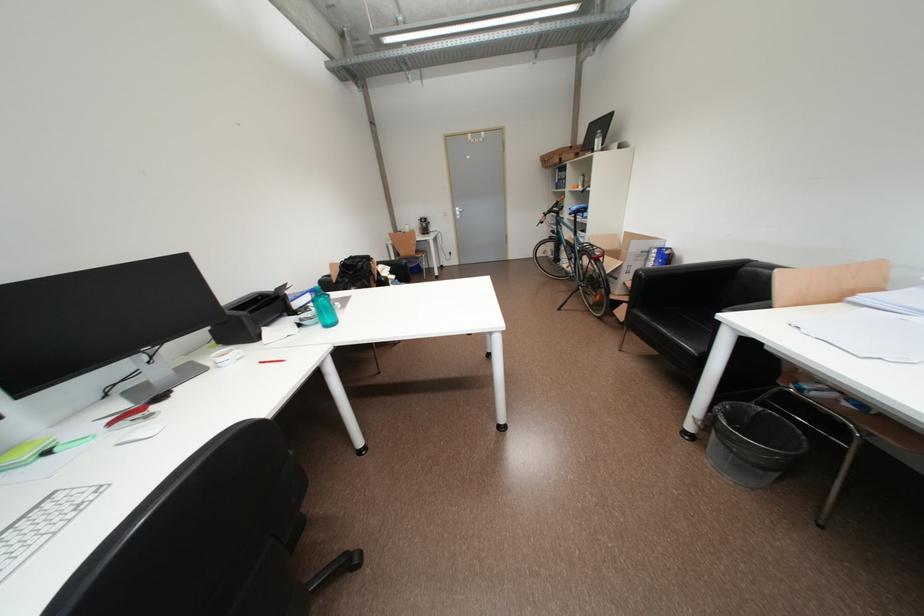
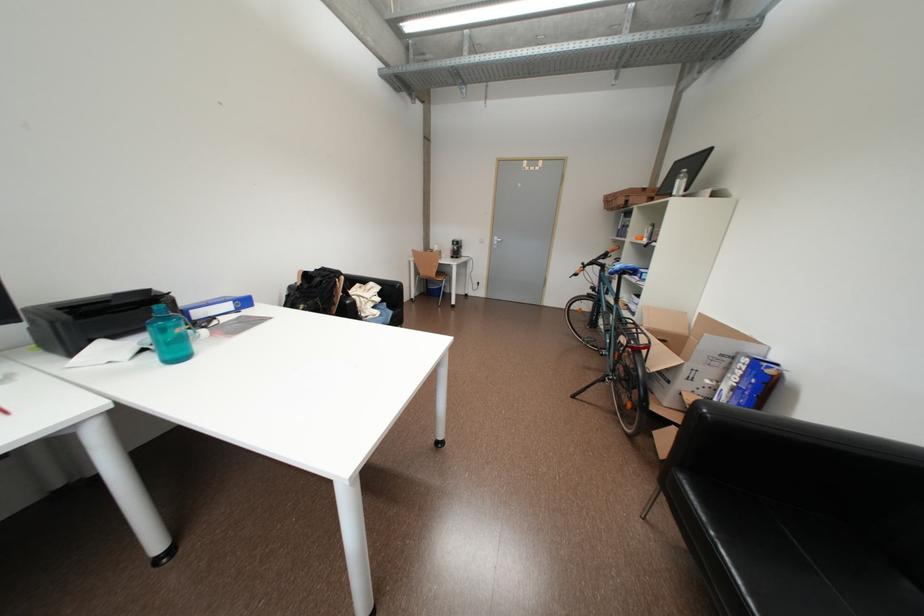
In the second image, find the point that corresponds to (643,274) in the first image.

(704, 406)